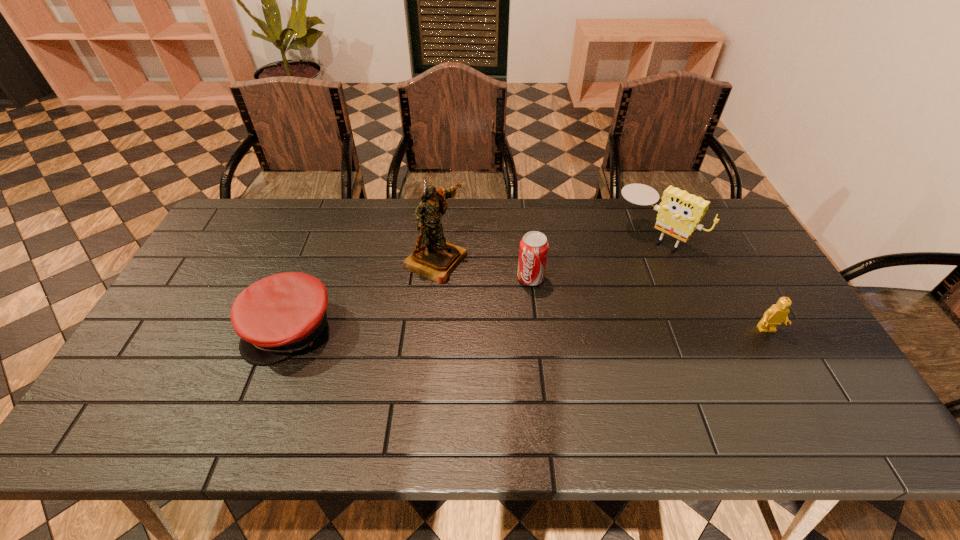
Where is `free space located on the logo side of the soda can`? This screenshot has height=540, width=960. free space located on the logo side of the soda can is located at coordinates (484, 348).

Locate an element on the screen. vacant space located 0.370m on the logo side of the soda can is located at coordinates (460, 384).

At what (x,y) coordinates should I click in order to perform the action: click on vacant space situated on the logo side of the soda can. Please return your answer as a coordinate pair (x, y). The height and width of the screenshot is (540, 960). Looking at the image, I should click on (505, 317).

At what (x,y) coordinates should I click in order to perform the action: click on vacant region located 0.100m on the front-facing side of the tallest object. Please return your answer as a coordinate pair (x, y). This screenshot has height=540, width=960. Looking at the image, I should click on (491, 285).

Identify the location of free point located 0.250m on the front-facing side of the tallest object. 537,305.

The image size is (960, 540). Find the location of `free space located 0.260m on the front-facing side of the tallest object`. free space located 0.260m on the front-facing side of the tallest object is located at coordinates (540, 306).

You are a GUI agent. You are given a task and a screenshot of the screen. Output one action in this format:
    pyautogui.click(x=<x>, y=<y>)
    Task: Click on the vacant area located 0.250m on the front-facing side of the fourth object from left to right
    The width and height of the screenshot is (960, 540).
    Given the screenshot: What is the action you would take?
    pyautogui.click(x=590, y=298)

At what (x,y) coordinates should I click in order to perform the action: click on vacant space situated 0.320m on the front-facing side of the fourth object from left to right. Please return your answer as a coordinate pair (x, y). Looking at the image, I should click on (577, 312).

Where is `free space located on the front-facing side of the fourth object from left to right`? This screenshot has height=540, width=960. free space located on the front-facing side of the fourth object from left to right is located at coordinates (575, 314).

You are a GUI agent. You are given a task and a screenshot of the screen. Output one action in this format:
    pyautogui.click(x=<x>, y=<y>)
    Task: Click on the figurine that is positioned at the far edge
    The image size is (960, 540).
    Given the screenshot: What is the action you would take?
    pyautogui.click(x=434, y=258)